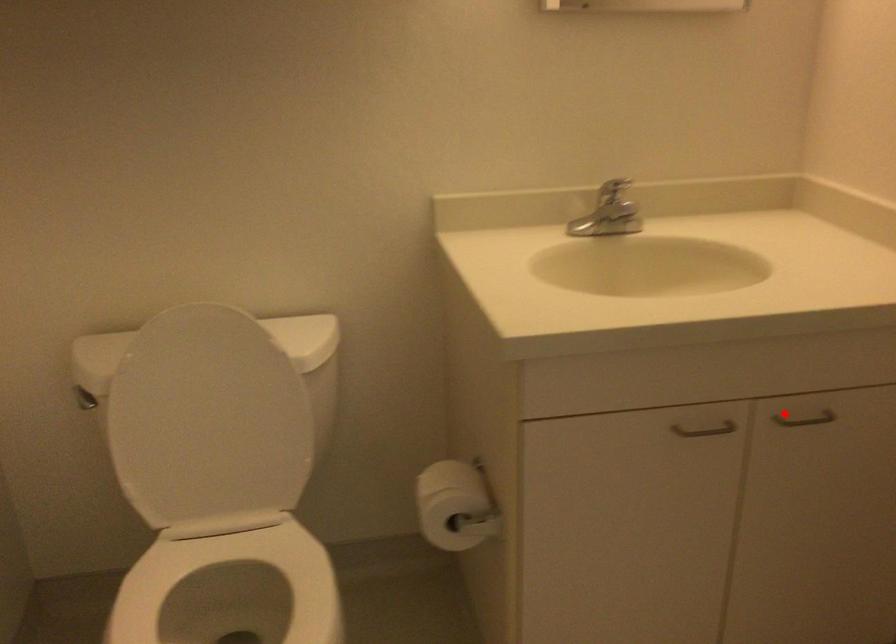
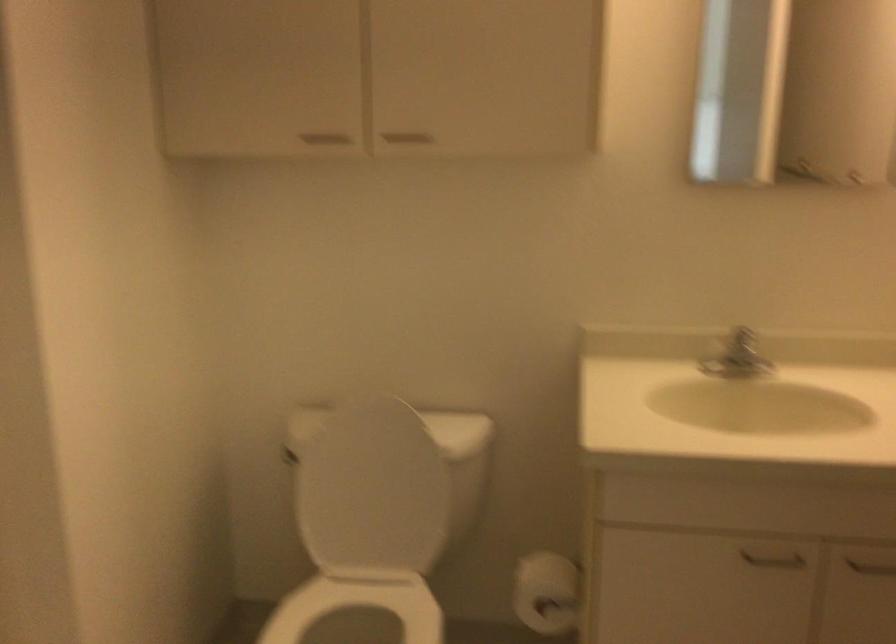
In the second image, find the point that corresponds to the highlighted location in the first image.

(865, 563)